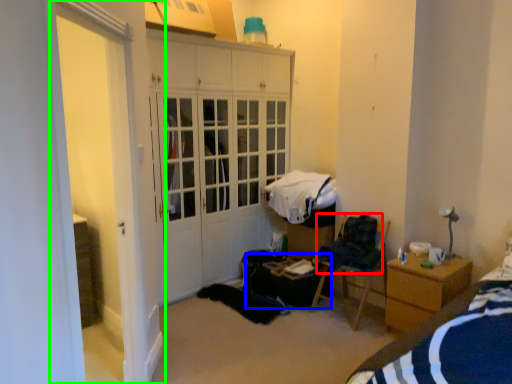
Question: Considering the real-world distances, which object is farthest from clothing (highlighted by a red box)? table (highlighted by a blue box) or screen door (highlighted by a green box)?

Choices:
 (A) table
 (B) screen door

Answer: (B)